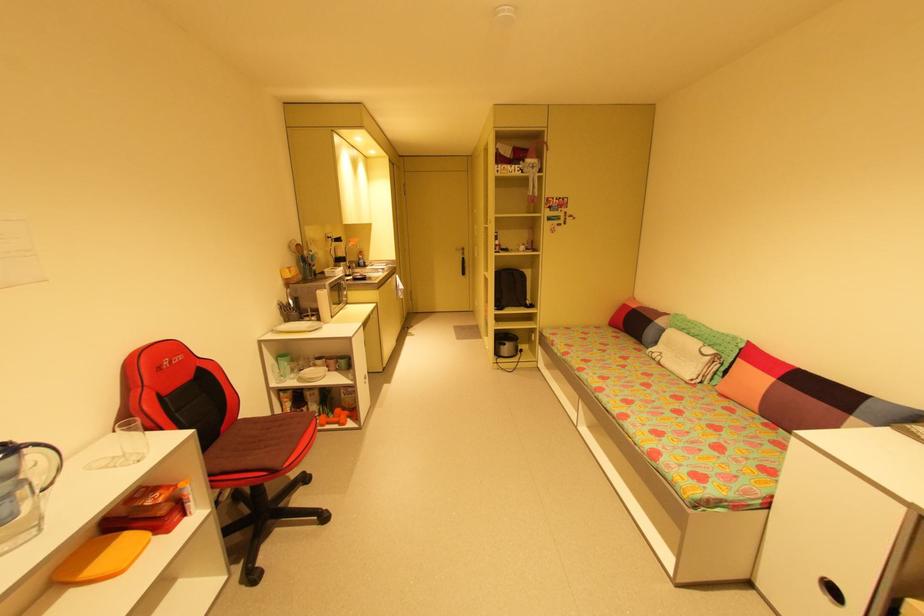
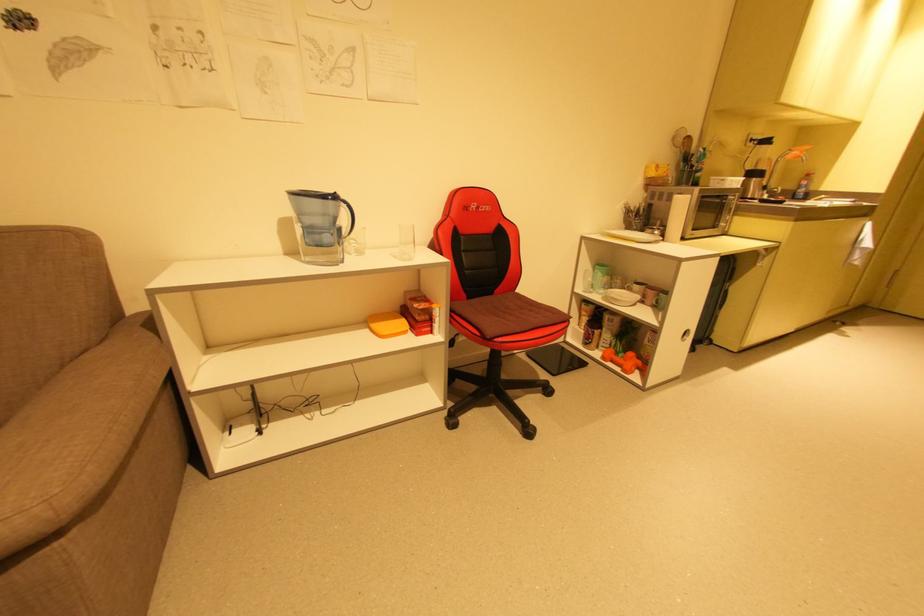
Where in the second image is the point corresponding to point (30, 450) from the first image?

(346, 204)